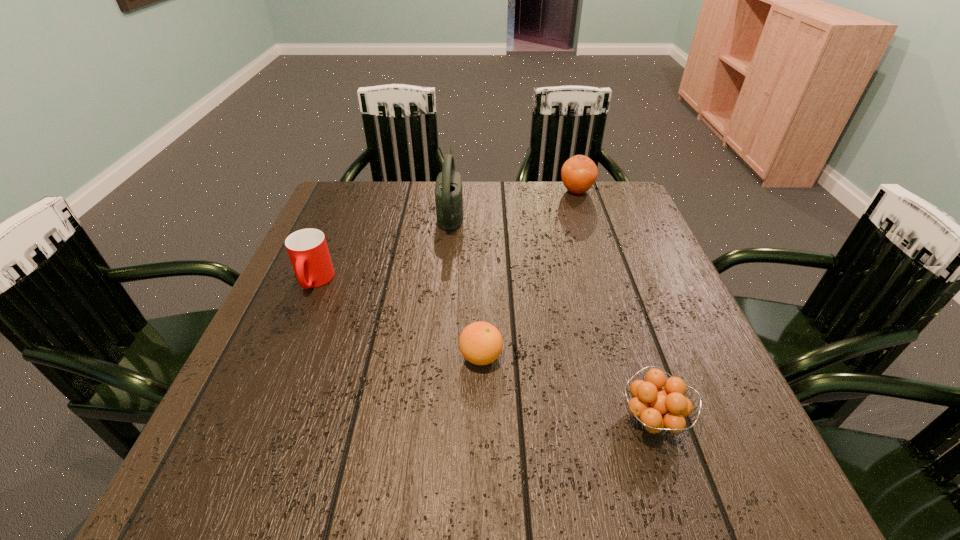
In the image, there is a desktop. Where is `vacant space at the left edge`? The image size is (960, 540). vacant space at the left edge is located at coordinates (288, 420).

In the image, there is a desktop. Where is `vacant space at the right edge`? The image size is (960, 540). vacant space at the right edge is located at coordinates (643, 356).

I want to click on vacant area at the far right corner, so click(626, 214).

Identify the location of vacant point located between the watering can and the tallest orange. The height and width of the screenshot is (540, 960). (514, 201).

Image resolution: width=960 pixels, height=540 pixels. Find the location of `vacant region between the tallest orange and the third nearest object`. vacant region between the tallest orange and the third nearest object is located at coordinates (445, 236).

Find the location of a particular element. The height and width of the screenshot is (540, 960). vacant region between the second nearest orange and the third farthest object is located at coordinates (397, 319).

This screenshot has height=540, width=960. What are the coordinates of `vacant space in between the leftmost object and the tallest object` in the screenshot? It's located at (382, 246).

This screenshot has height=540, width=960. Identify the location of free spot between the tallest object and the tallest orange. (514, 201).

Where is `vacant area between the leftmost orange and the farthest orange`? vacant area between the leftmost orange and the farthest orange is located at coordinates (529, 274).

You are a GUI agent. You are given a task and a screenshot of the screen. Output one action in this format:
    pyautogui.click(x=<x>, y=<y>)
    Task: Click on the empty space that is in between the farthest orange and the watering can
    The height and width of the screenshot is (540, 960).
    Given the screenshot: What is the action you would take?
    514,201